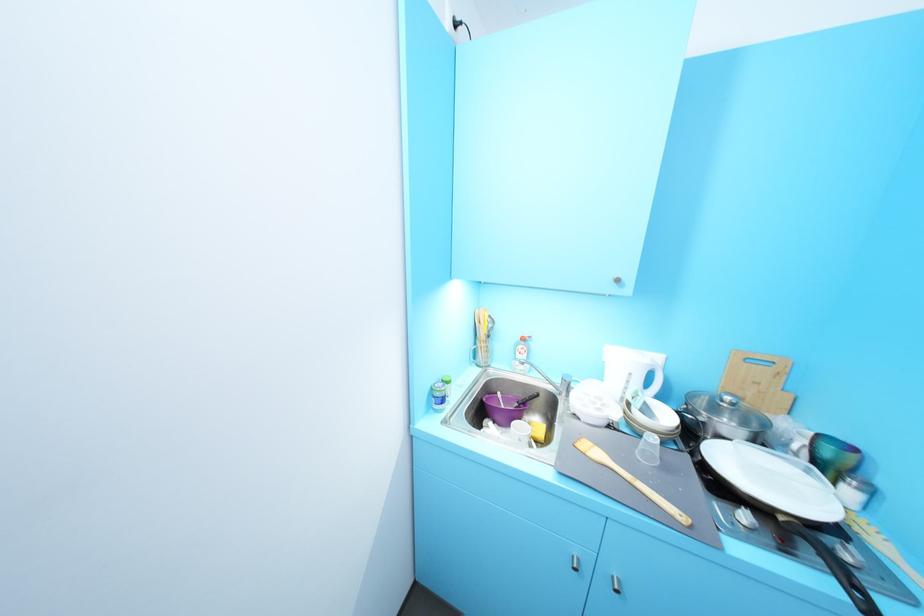
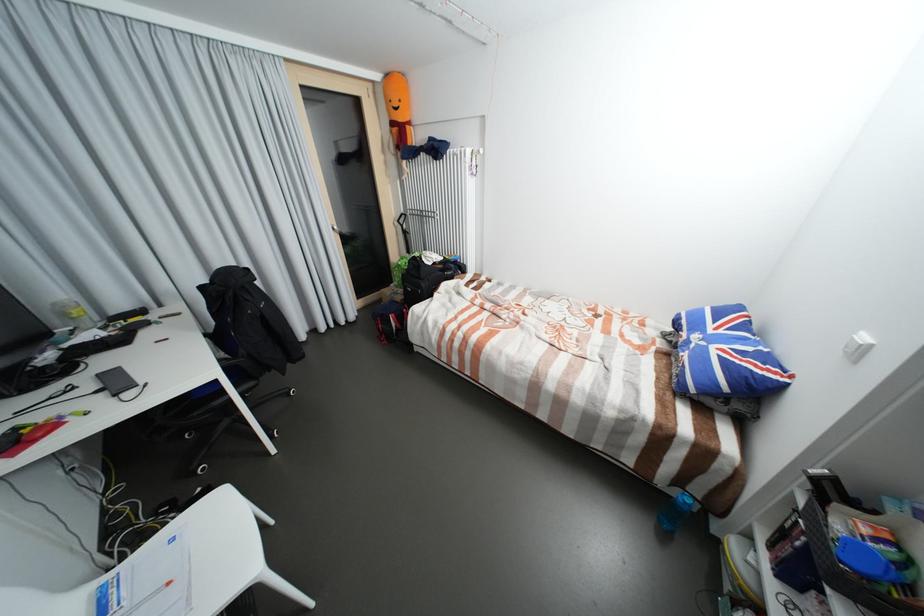
Question: What movement of the cameraman would produce the second image?

Choices:
 (A) Left
 (B) Right
 (C) Forward
 (D) Backward

Answer: (A)